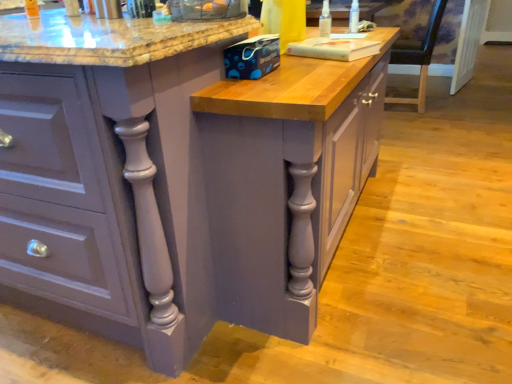
Question: Is matte gray cabinet at center not inside transparent plastic spray bottle at upper right, the second bottle in the left-to-right sequence?

Choices:
 (A) no
 (B) yes

Answer: (B)

Question: Does matte gray cabinet at center appear on the right side of transparent plastic spray bottle at upper right, the second bottle in the left-to-right sequence?

Choices:
 (A) yes
 (B) no

Answer: (B)

Question: From a real-world perspective, is matte gray cabinet at center located beneath transparent plastic spray bottle at upper right, the second bottle in the left-to-right sequence?

Choices:
 (A) yes
 (B) no

Answer: (A)

Question: Can you confirm if matte gray cabinet at center is bigger than transparent plastic spray bottle at upper right, which ranks as the 2th bottle in front-to-back order?

Choices:
 (A) yes
 (B) no

Answer: (A)

Question: From a real-world perspective, is matte gray cabinet at center physically above transparent plastic spray bottle at upper right, the 1th bottle in the back-to-front sequence?

Choices:
 (A) no
 (B) yes

Answer: (A)

Question: From the image's perspective, is matte gray cabinet at center over transparent plastic spray bottle at upper right, which ranks as the 2th bottle in front-to-back order?

Choices:
 (A) yes
 (B) no

Answer: (B)

Question: Is wooden chair at right further to camera compared to matte gray cabinet at center?

Choices:
 (A) yes
 (B) no

Answer: (A)

Question: Can you confirm if wooden chair at right is taller than matte gray cabinet at center?

Choices:
 (A) yes
 (B) no

Answer: (B)

Question: From the image's perspective, is wooden chair at right on matte gray cabinet at center?

Choices:
 (A) no
 (B) yes

Answer: (B)

Question: Does wooden chair at right have a greater width compared to matte gray cabinet at center?

Choices:
 (A) no
 (B) yes

Answer: (A)

Question: Is wooden chair at right far away from matte gray cabinet at center?

Choices:
 (A) yes
 (B) no

Answer: (A)

Question: Is wooden chair at right next to matte gray cabinet at center?

Choices:
 (A) no
 (B) yes

Answer: (A)

Question: Is wooden chair at right beside transparent plastic spray bottle at upper right, which ranks as the 2th bottle in front-to-back order?

Choices:
 (A) no
 (B) yes

Answer: (A)